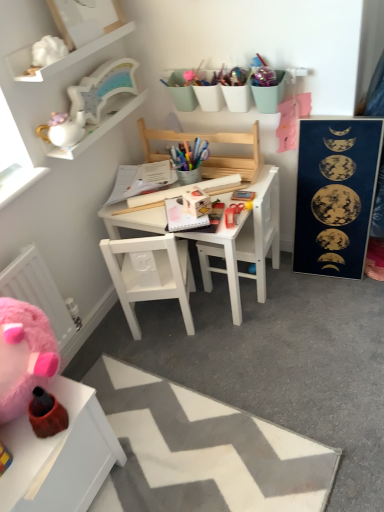
Where is `vacant space underneath blue matte poster at right (from a real-world perspective)`? The height and width of the screenshot is (512, 384). vacant space underneath blue matte poster at right (from a real-world perspective) is located at coordinates (322, 275).